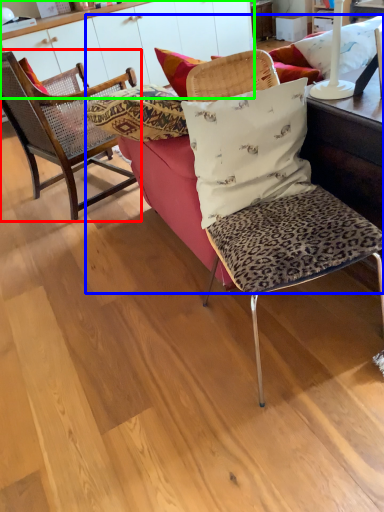
Question: Which is farther away from chair (highlighted by a red box)? studio couch (highlighted by a blue box) or dresser (highlighted by a green box)?

Choices:
 (A) studio couch
 (B) dresser

Answer: (B)